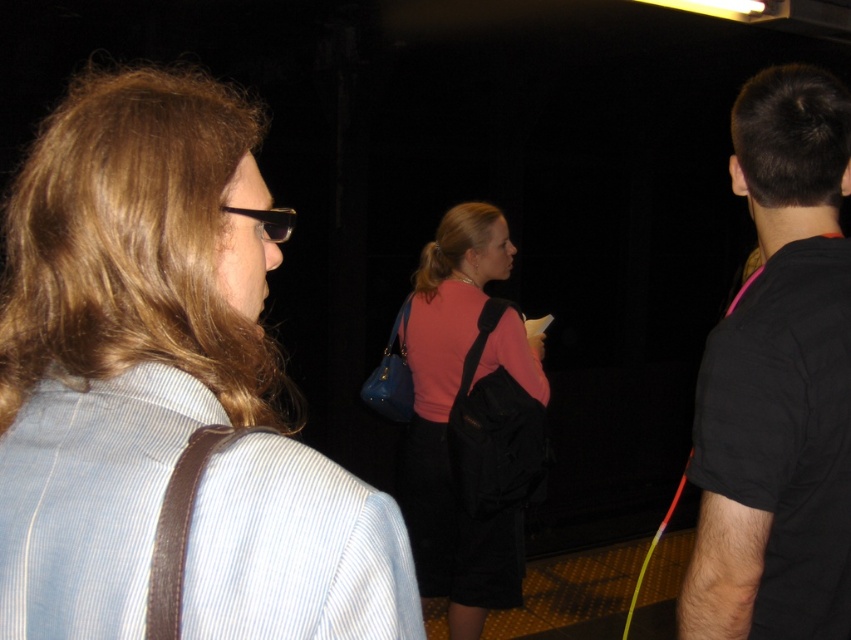
Question: Which point appears farthest from the camera in this image?

Choices:
 (A) (777, 509)
 (B) (495, 262)

Answer: (B)

Question: Which point is closer to the camera?

Choices:
 (A) pink matte sweater at center
 (B) light blue striped shirt at left

Answer: (B)

Question: Estimate the real-world distances between objects in this image. Which object is closer to the black matte shirt at right?

Choices:
 (A) black plastic sunglasses at upper left
 (B) pink matte sweater at center
 (C) light blue striped shirt at left

Answer: (C)

Question: Does light blue striped shirt at left appear over black plastic sunglasses at upper left?

Choices:
 (A) yes
 (B) no

Answer: (B)

Question: Does pink matte sweater at center appear on the left side of black plastic sunglasses at upper left?

Choices:
 (A) yes
 (B) no

Answer: (B)

Question: Is black matte shirt at right below pink matte sweater at center?

Choices:
 (A) yes
 (B) no

Answer: (B)